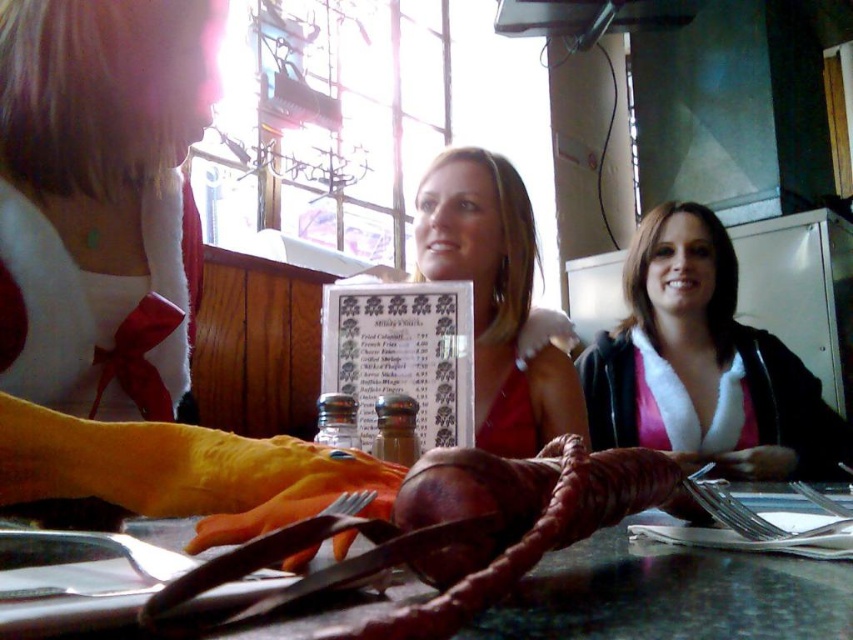
Question: Among these points, which one is farthest from the camera?

Choices:
 (A) (457, 317)
 (B) (561, 412)

Answer: (B)

Question: Is shiny metallic table at center to the right of pink fleece-lined jacket at center from the viewer's perspective?

Choices:
 (A) yes
 (B) no

Answer: (B)

Question: Which object is positioned closest to the white plush doll at upper left?

Choices:
 (A) matte red dress at center
 (B) pink fleece-lined jacket at center
 (C) white paper menu at center
 (D) shiny metallic table at center

Answer: (D)

Question: Can you confirm if shiny metallic table at center is positioned to the right of pink fleece-lined jacket at center?

Choices:
 (A) yes
 (B) no

Answer: (B)

Question: Considering the relative positions of white plush doll at upper left and matte red dress at center in the image provided, where is white plush doll at upper left located with respect to matte red dress at center?

Choices:
 (A) right
 (B) left

Answer: (B)

Question: Which point is closer to the camera taking this photo?

Choices:
 (A) (254, 518)
 (B) (659, 241)
 (C) (444, 349)

Answer: (A)